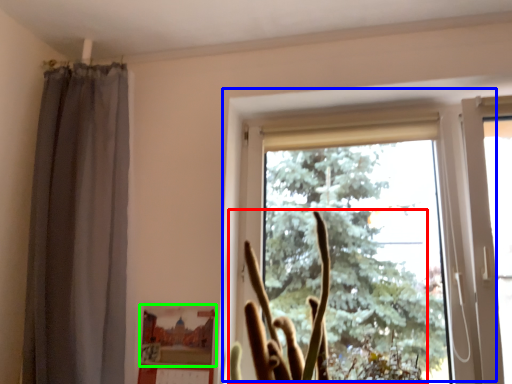
Question: Which object is the farthest from plant (highlighted by a red box)? Choose among these: window (highlighted by a blue box) or picture frame (highlighted by a green box).

Choices:
 (A) window
 (B) picture frame

Answer: (A)